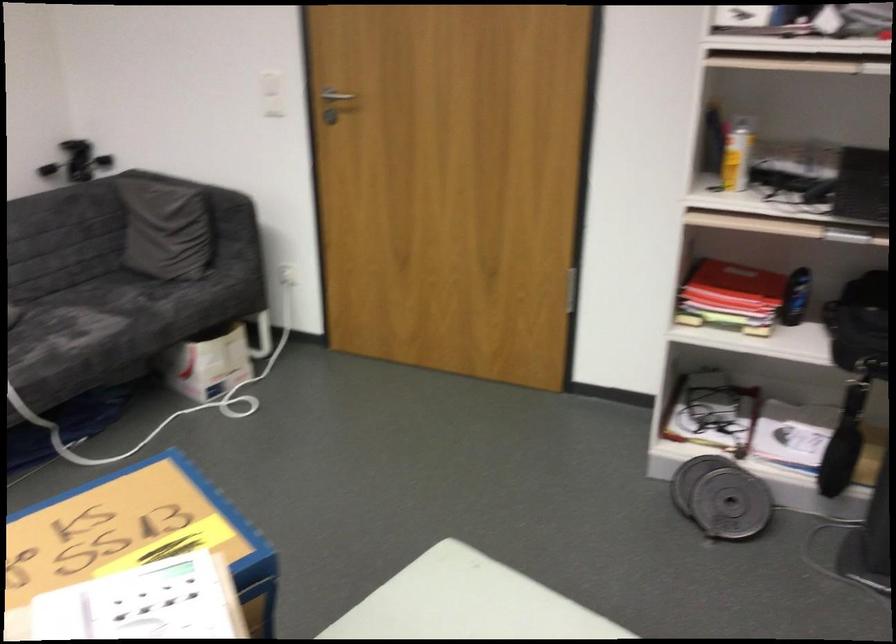
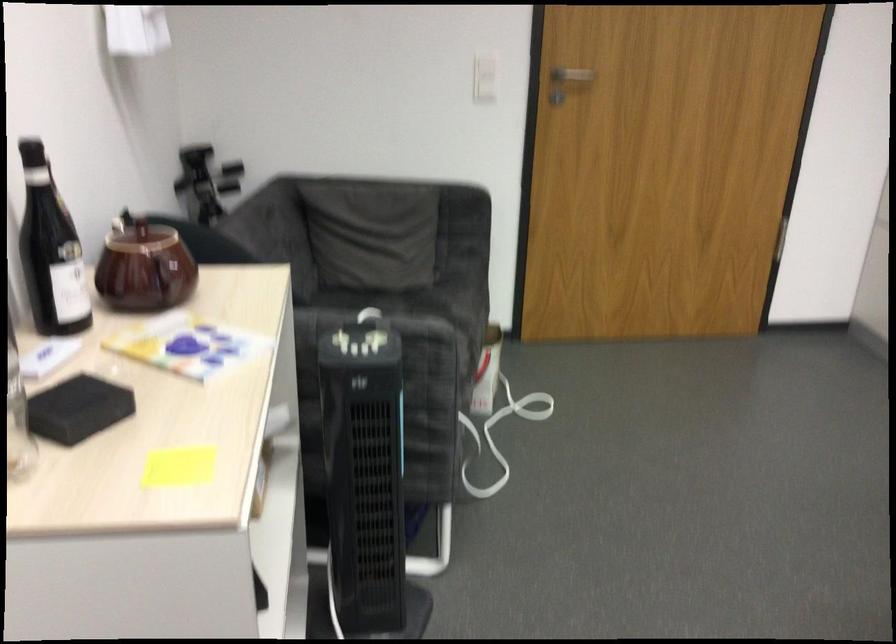
The point at (334, 104) is marked in the first image. Where is the corresponding point in the second image?

(569, 77)